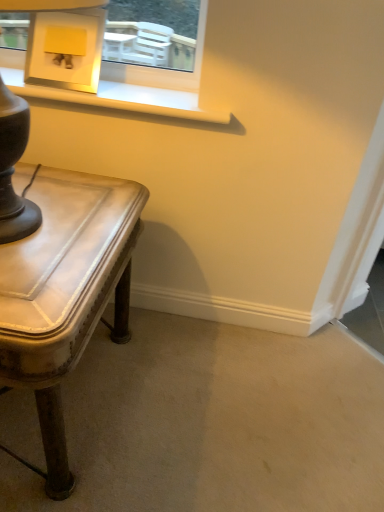
Question: Does leather-like table at lower left have a smaller size compared to matte brown table lamp at left?

Choices:
 (A) no
 (B) yes

Answer: (A)

Question: From the image's perspective, is leather-like table at lower left on matte brown table lamp at left?

Choices:
 (A) no
 (B) yes

Answer: (A)

Question: From a real-world perspective, is leather-like table at lower left located beneath matte brown table lamp at left?

Choices:
 (A) no
 (B) yes

Answer: (B)

Question: Does leather-like table at lower left come in front of matte brown table lamp at left?

Choices:
 (A) no
 (B) yes

Answer: (A)

Question: Would you consider leather-like table at lower left to be distant from matte brown table lamp at left?

Choices:
 (A) no
 (B) yes

Answer: (A)

Question: Is leather-like table at lower left oriented towards matte brown table lamp at left?

Choices:
 (A) yes
 (B) no

Answer: (B)

Question: Is matte brown table lamp at left turned away from leather-like table at lower left?

Choices:
 (A) yes
 (B) no

Answer: (B)

Question: Does matte brown table lamp at left have a larger size compared to leather-like table at lower left?

Choices:
 (A) yes
 (B) no

Answer: (B)

Question: Can you confirm if matte brown table lamp at left is smaller than leather-like table at lower left?

Choices:
 (A) no
 (B) yes

Answer: (B)

Question: Is matte brown table lamp at left in contact with leather-like table at lower left?

Choices:
 (A) no
 (B) yes

Answer: (A)

Question: Considering the relative positions of matte brown table lamp at left and leather-like table at lower left in the image provided, is matte brown table lamp at left to the right of leather-like table at lower left from the viewer's perspective?

Choices:
 (A) yes
 (B) no

Answer: (A)

Question: Is matte brown table lamp at left further to camera compared to leather-like table at lower left?

Choices:
 (A) yes
 (B) no

Answer: (B)

Question: Would you say matte brown table lamp at left is inside or outside leather-like table at lower left?

Choices:
 (A) outside
 (B) inside

Answer: (A)